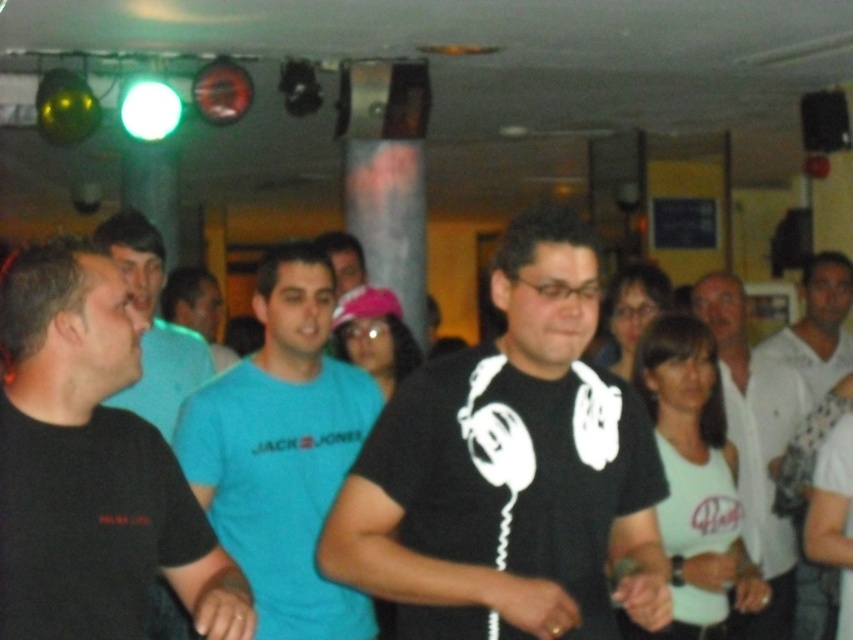
Question: Is black matte shirt at left closer to camera compared to blue t-shirt at center?

Choices:
 (A) no
 (B) yes

Answer: (B)

Question: Which of the following is the farthest from the observer?

Choices:
 (A) (401, 518)
 (B) (99, 280)

Answer: (A)

Question: Does teal t-shirt at center come in front of white matte shirt at center?

Choices:
 (A) yes
 (B) no

Answer: (A)

Question: Which point is closer to the camera?

Choices:
 (A) black matte t-shirt at center
 (B) black matte shirt at left

Answer: (A)

Question: Which point is farther to the camera?

Choices:
 (A) (201, 333)
 (B) (532, 458)
 (C) (219, 592)

Answer: (A)

Question: Can you confirm if black matte t-shirt at left is positioned to the right of teal t-shirt at center?

Choices:
 (A) yes
 (B) no

Answer: (B)